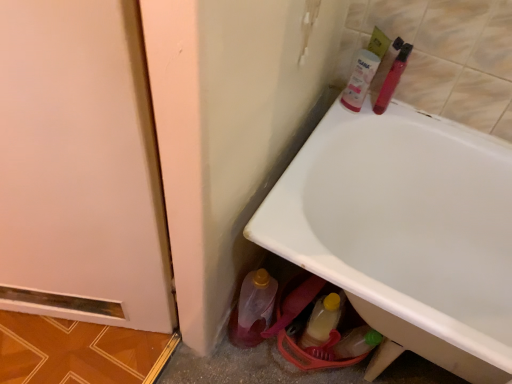
Measure the distance between point (x=271, y=308) and camera.

Point (x=271, y=308) and camera are 4.16 feet apart.

The image size is (512, 384). What do you see at coordinates (253, 309) in the screenshot? I see `translucent plastic bottle at lower center, which is counted as the first bottle, starting from the left` at bounding box center [253, 309].

Image resolution: width=512 pixels, height=384 pixels. What do you see at coordinates (392, 79) in the screenshot?
I see `translucent plastic tube at upper right, which ranks as the first mouthwash in right-to-left order` at bounding box center [392, 79].

Where is `translucent plastic tube at upper right, which is the second mouthwash from left to right`? The width and height of the screenshot is (512, 384). translucent plastic tube at upper right, which is the second mouthwash from left to right is located at coordinates (392, 79).

Locate an element on the screen. This screenshot has height=384, width=512. translucent plastic bottle at lower center, which is counted as the first bottle, starting from the left is located at coordinates (253, 309).

From a real-world perspective, is white glossy bathtub at lower right physically above translucent plastic bottle at lower center, which is counted as the first bottle, starting from the left?

Yes, from a real-world perspective, white glossy bathtub at lower right is above translucent plastic bottle at lower center, which is counted as the first bottle, starting from the left.

Is white glossy bathtub at lower right taller than translucent plastic bottle at lower center, the second bottle viewed from the right?

Yes.

Are white glossy bathtub at lower right and translucent plastic bottle at lower center, the second bottle viewed from the right, far apart?

Actually, white glossy bathtub at lower right and translucent plastic bottle at lower center, the second bottle viewed from the right, are a little close together.

Is translucent plastic tube at upper right, which ranks as the first mouthwash in right-to-left order, positioned beyond the bounds of translucent plastic bottle at lower center, which is counted as the first bottle, starting from the left?

Indeed, translucent plastic tube at upper right, which ranks as the first mouthwash in right-to-left order, is completely outside translucent plastic bottle at lower center, which is counted as the first bottle, starting from the left.

Based on the photo, is translucent plastic tube at upper right, which ranks as the first mouthwash in right-to-left order, next to translucent plastic bottle at lower center, the second bottle viewed from the right?

No, translucent plastic tube at upper right, which ranks as the first mouthwash in right-to-left order, is not in contact with translucent plastic bottle at lower center, the second bottle viewed from the right.

Find the location of `the 1st bottle below when counting from the translucent plastic tube at upper right, which is the second mouthwash from left to right (from the image's perspective)`. the 1st bottle below when counting from the translucent plastic tube at upper right, which is the second mouthwash from left to right (from the image's perspective) is located at coordinates (253, 309).

Considering the relative sizes of white glossy bathtub at lower right and translucent yellow plastic bottle at lower center, which is counted as the first bottle, starting from the right, in the image provided, is white glossy bathtub at lower right smaller than translucent yellow plastic bottle at lower center, which is counted as the first bottle, starting from the right,?

Actually, white glossy bathtub at lower right might be larger than translucent yellow plastic bottle at lower center, which is counted as the first bottle, starting from the right.

From a real-world perspective, which object stands above the other?

In real-world perspective, white glossy bathtub at lower right is above.

Which is nearer, (x=392, y=164) or (x=328, y=323)?

Point (x=392, y=164) is positioned farther from the camera compared to point (x=328, y=323).

Are white glossy bathtub at lower right and translucent yellow plastic bottle at lower center, which is counted as the first bottle, starting from the right, beside each other?

No, white glossy bathtub at lower right is not touching translucent yellow plastic bottle at lower center, which is counted as the first bottle, starting from the right.

In terms of height, does white glossy bathtub at lower right look taller or shorter compared to pink plastic tube at upper right, acting as the first mouthwash starting from the left?

In the image, white glossy bathtub at lower right appears to be taller than pink plastic tube at upper right, acting as the first mouthwash starting from the left.

Considering the positions of points (386, 273) and (366, 89), is point (386, 273) farther from camera compared to point (366, 89)?

Yes, it is.

From the image's perspective, is white glossy bathtub at lower right positioned above or below pink plastic tube at upper right, acting as the first mouthwash starting from the left?

white glossy bathtub at lower right is situated lower than pink plastic tube at upper right, acting as the first mouthwash starting from the left, in the image.

Is translucent yellow plastic bottle at lower center, the 2th bottle viewed from the left, completely or partially outside of translucent plastic bottle at lower center, which is counted as the first bottle, starting from the left?

Yes, translucent yellow plastic bottle at lower center, the 2th bottle viewed from the left, is outside of translucent plastic bottle at lower center, which is counted as the first bottle, starting from the left.

What are the coordinates of `bottle above the translucent plastic bottle at lower center, the second bottle viewed from the right (from a real-world perspective)` in the screenshot? It's located at (321, 321).

Could you measure the distance between translucent yellow plastic bottle at lower center, the 2th bottle viewed from the left, and translucent plastic bottle at lower center, the second bottle viewed from the right?

A distance of 7.13 inches exists between translucent yellow plastic bottle at lower center, the 2th bottle viewed from the left, and translucent plastic bottle at lower center, the second bottle viewed from the right.

Considering the relative sizes of translucent yellow plastic bottle at lower center, the 2th bottle viewed from the left, and translucent plastic bottle at lower center, which is counted as the first bottle, starting from the left, in the image provided, is translucent yellow plastic bottle at lower center, the 2th bottle viewed from the left, thinner than translucent plastic bottle at lower center, which is counted as the first bottle, starting from the left,?

Yes, translucent yellow plastic bottle at lower center, the 2th bottle viewed from the left, is thinner than translucent plastic bottle at lower center, which is counted as the first bottle, starting from the left.

Is white glossy bathtub at lower right located within translucent yellow plastic bottle at lower center, the 2th bottle viewed from the left?

No, white glossy bathtub at lower right is located outside of translucent yellow plastic bottle at lower center, the 2th bottle viewed from the left.

How far apart are translucent yellow plastic bottle at lower center, the 2th bottle viewed from the left, and white glossy bathtub at lower right?

translucent yellow plastic bottle at lower center, the 2th bottle viewed from the left, and white glossy bathtub at lower right are 15.45 inches apart.

Is the position of translucent yellow plastic bottle at lower center, the 2th bottle viewed from the left, less distant than that of white glossy bathtub at lower right?

No, the depth of translucent yellow plastic bottle at lower center, the 2th bottle viewed from the left, is greater than that of white glossy bathtub at lower right.

Consider the image. From the image's perspective, which one is positioned lower, translucent yellow plastic bottle at lower center, the 2th bottle viewed from the left, or white glossy bathtub at lower right?

translucent yellow plastic bottle at lower center, the 2th bottle viewed from the left, from the image's perspective.

From the image's perspective, is translucent plastic bottle at lower center, the second bottle viewed from the right, located above translucent yellow plastic bottle at lower center, which is counted as the first bottle, starting from the right?

Yes, from the image's perspective, translucent plastic bottle at lower center, the second bottle viewed from the right, is over translucent yellow plastic bottle at lower center, which is counted as the first bottle, starting from the right.

From a real-world perspective, is translucent plastic bottle at lower center, which is counted as the first bottle, starting from the left, physically located above or below translucent yellow plastic bottle at lower center, the 2th bottle viewed from the left?

translucent plastic bottle at lower center, which is counted as the first bottle, starting from the left, is below translucent yellow plastic bottle at lower center, the 2th bottle viewed from the left.

Can you tell me how much translucent plastic bottle at lower center, which is counted as the first bottle, starting from the left, and translucent yellow plastic bottle at lower center, which is counted as the first bottle, starting from the right, differ in facing direction?

The facing directions of translucent plastic bottle at lower center, which is counted as the first bottle, starting from the left, and translucent yellow plastic bottle at lower center, which is counted as the first bottle, starting from the right, are 0.000416 degrees apart.

Is translucent plastic bottle at lower center, which is counted as the first bottle, starting from the left, facing towards translucent yellow plastic bottle at lower center, the 2th bottle viewed from the left?

No.

From the image's perspective, which bottle is the 1st one below the white glossy bathtub at lower right? Please provide its 2D coordinates.

[(253, 309)]

From the image's perspective, which mouthwash is the 2nd one above the translucent plastic bottle at lower center, which is counted as the first bottle, starting from the left? Please provide its 2D coordinates.

[(392, 79)]

Considering their positions, is translucent yellow plastic bottle at lower center, which is counted as the first bottle, starting from the right, positioned closer to translucent plastic bottle at lower center, the second bottle viewed from the right, than translucent plastic tube at upper right, which ranks as the first mouthwash in right-to-left order?

Among the two, translucent yellow plastic bottle at lower center, which is counted as the first bottle, starting from the right, is located nearer to translucent plastic bottle at lower center, the second bottle viewed from the right.

Which object lies nearer to the anchor point translucent yellow plastic bottle at lower center, which is counted as the first bottle, starting from the right, translucent plastic bottle at lower center, the second bottle viewed from the right, or white glossy bathtub at lower right?

translucent plastic bottle at lower center, the second bottle viewed from the right, lies closer to translucent yellow plastic bottle at lower center, which is counted as the first bottle, starting from the right, than the other object.

From the image, which object appears to be nearer to pink plastic tube at upper right, acting as the first mouthwash starting from the left, white glossy bathtub at lower right or translucent plastic tube at upper right, which is the second mouthwash from left to right?

translucent plastic tube at upper right, which is the second mouthwash from left to right.

Which object lies further to the anchor point translucent plastic tube at upper right, which is the second mouthwash from left to right, translucent plastic bottle at lower center, the second bottle viewed from the right, or translucent yellow plastic bottle at lower center, which is counted as the first bottle, starting from the right?

Based on the image, translucent plastic bottle at lower center, the second bottle viewed from the right, appears to be further to translucent plastic tube at upper right, which is the second mouthwash from left to right.

From the image, which object appears to be nearer to translucent yellow plastic bottle at lower center, the 2th bottle viewed from the left, pink plastic tube at upper right, acting as the first mouthwash starting from the left, or translucent plastic bottle at lower center, the second bottle viewed from the right?

translucent plastic bottle at lower center, the second bottle viewed from the right, lies closer to translucent yellow plastic bottle at lower center, the 2th bottle viewed from the left, than the other object.

When comparing their distances from white glossy bathtub at lower right, does translucent plastic tube at upper right, which ranks as the first mouthwash in right-to-left order, or translucent yellow plastic bottle at lower center, the 2th bottle viewed from the left, seem closer?

translucent yellow plastic bottle at lower center, the 2th bottle viewed from the left, is positioned closer to the anchor white glossy bathtub at lower right.

Which object lies further to the anchor point translucent yellow plastic bottle at lower center, which is counted as the first bottle, starting from the right, pink plastic tube at upper right, acting as the first mouthwash starting from the left, or translucent plastic tube at upper right, which ranks as the first mouthwash in right-to-left order?

translucent plastic tube at upper right, which ranks as the first mouthwash in right-to-left order, is positioned further to the anchor translucent yellow plastic bottle at lower center, which is counted as the first bottle, starting from the right.

From the picture: Based on their spatial positions, is translucent yellow plastic bottle at lower center, the 2th bottle viewed from the left, or translucent plastic tube at upper right, which ranks as the first mouthwash in right-to-left order, closer to pink plastic tube at upper right, acting as the first mouthwash starting from the left?

Among the two, translucent plastic tube at upper right, which ranks as the first mouthwash in right-to-left order, is located nearer to pink plastic tube at upper right, acting as the first mouthwash starting from the left.

Where is `bathtub between pink plastic tube at upper right, acting as the first mouthwash starting from the left, and translucent yellow plastic bottle at lower center, which is counted as the first bottle, starting from the right, in the up-down direction`? The width and height of the screenshot is (512, 384). bathtub between pink plastic tube at upper right, acting as the first mouthwash starting from the left, and translucent yellow plastic bottle at lower center, which is counted as the first bottle, starting from the right, in the up-down direction is located at coordinates (405, 231).

This screenshot has height=384, width=512. What are the coordinates of `mouthwash between translucent plastic tube at upper right, which ranks as the first mouthwash in right-to-left order, and translucent plastic bottle at lower center, which is counted as the first bottle, starting from the left, in the vertical direction` in the screenshot? It's located at (360, 79).

At what (x,y) coordinates should I click in order to perform the action: click on bathtub between translucent plastic tube at upper right, which is the second mouthwash from left to right, and translucent yellow plastic bottle at lower center, the 2th bottle viewed from the left, vertically. Please return your answer as a coordinate pair (x, y). This screenshot has width=512, height=384. Looking at the image, I should click on (405, 231).

Where is `mouthwash between translucent plastic tube at upper right, which is the second mouthwash from left to right, and translucent yellow plastic bottle at lower center, the 2th bottle viewed from the left, in the up-down direction`? The height and width of the screenshot is (384, 512). mouthwash between translucent plastic tube at upper right, which is the second mouthwash from left to right, and translucent yellow plastic bottle at lower center, the 2th bottle viewed from the left, in the up-down direction is located at coordinates (360, 79).